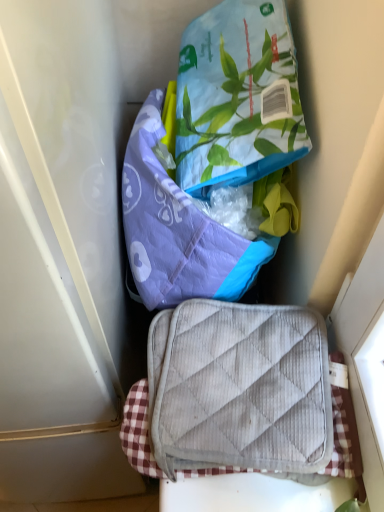
Question: In which direction should I rotate to look at purple quilted pouch at center, placed as the second pouch when sorted from top to bottom?

Choices:
 (A) right
 (B) left

Answer: (A)

Question: Could you tell me if purple quilted pouch at center, placed as the second pouch when sorted from top to bottom, is facing printed fabric pouch at upper center, the 1th pouch in the top-to-bottom sequence?

Choices:
 (A) yes
 (B) no

Answer: (B)

Question: Is purple quilted pouch at center, placed as the second pouch when sorted from top to bottom, next to printed fabric pouch at upper center, which appears as the second pouch when ordered from the bottom?

Choices:
 (A) yes
 (B) no

Answer: (B)

Question: Is purple quilted pouch at center, placed as the first pouch when sorted from bottom to top, facing away from printed fabric pouch at upper center, which appears as the second pouch when ordered from the bottom?

Choices:
 (A) yes
 (B) no

Answer: (B)

Question: From a real-world perspective, is purple quilted pouch at center, placed as the second pouch when sorted from top to bottom, physically above printed fabric pouch at upper center, which appears as the second pouch when ordered from the bottom?

Choices:
 (A) yes
 (B) no

Answer: (B)

Question: Could printed fabric pouch at upper center, which appears as the second pouch when ordered from the bottom, be considered to be inside purple quilted pouch at center, placed as the first pouch when sorted from bottom to top?

Choices:
 (A) yes
 (B) no

Answer: (B)

Question: Is purple quilted pouch at center, placed as the second pouch when sorted from top to bottom, to the left of printed fabric pouch at upper center, the 1th pouch in the top-to-bottom sequence, from the viewer's perspective?

Choices:
 (A) no
 (B) yes

Answer: (B)

Question: Would you say purple quilted pouch at center, placed as the second pouch when sorted from top to bottom, is outside gray quilted suitcase at center?

Choices:
 (A) no
 (B) yes

Answer: (B)

Question: Is purple quilted pouch at center, placed as the second pouch when sorted from top to bottom, facing towards gray quilted suitcase at center?

Choices:
 (A) no
 (B) yes

Answer: (B)

Question: From the image's perspective, is purple quilted pouch at center, placed as the first pouch when sorted from bottom to top, on gray quilted suitcase at center?

Choices:
 (A) no
 (B) yes

Answer: (B)

Question: Is purple quilted pouch at center, placed as the first pouch when sorted from bottom to top, to the left of gray quilted suitcase at center from the viewer's perspective?

Choices:
 (A) yes
 (B) no

Answer: (A)

Question: Does purple quilted pouch at center, placed as the second pouch when sorted from top to bottom, have a larger size compared to gray quilted suitcase at center?

Choices:
 (A) no
 (B) yes

Answer: (B)

Question: Is purple quilted pouch at center, placed as the second pouch when sorted from top to bottom, closer to camera compared to gray quilted suitcase at center?

Choices:
 (A) no
 (B) yes

Answer: (A)

Question: Is printed fabric pouch at upper center, the 1th pouch in the top-to-bottom sequence, aimed at purple quilted pouch at center, placed as the first pouch when sorted from bottom to top?

Choices:
 (A) no
 (B) yes

Answer: (A)